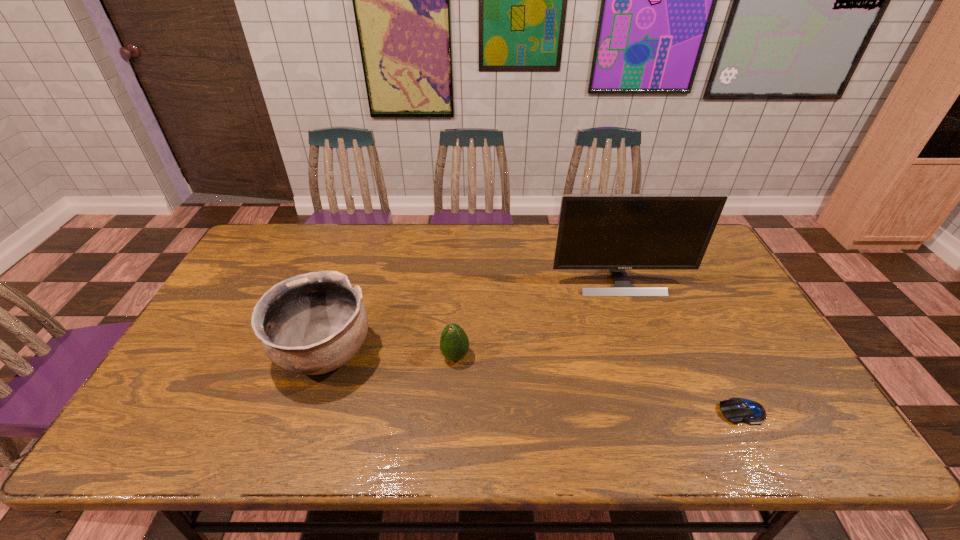
You are a GUI agent. You are given a task and a screenshot of the screen. Output one action in this format:
    pyautogui.click(x=<x>, y=<y>)
    Task: Click on the empty space between the third object from right to left and the nearest object
    
    Given the screenshot: What is the action you would take?
    pyautogui.click(x=598, y=384)

Where is `vacant area that lies between the farthest object and the nearest object`? vacant area that lies between the farthest object and the nearest object is located at coordinates (681, 346).

Identify the location of free space between the monitor and the pottery. (472, 317).

You are a GUI agent. You are given a task and a screenshot of the screen. Output one action in this format:
    pyautogui.click(x=<x>, y=<y>)
    Task: Click on the unoccupied position between the third tallest object and the monitor
    The width and height of the screenshot is (960, 540).
    Given the screenshot: What is the action you would take?
    pyautogui.click(x=538, y=319)

Find the location of a particular element. The width and height of the screenshot is (960, 540). the third closest object relative to the farthest object is located at coordinates (310, 324).

Select which object is the third closest to the pottery. Please provide its 2D coordinates. Your answer should be formatted as a tuple, i.e. [(x, y)], where the tuple contains the x and y coordinates of a point satisfying the conditions above.

[(736, 410)]